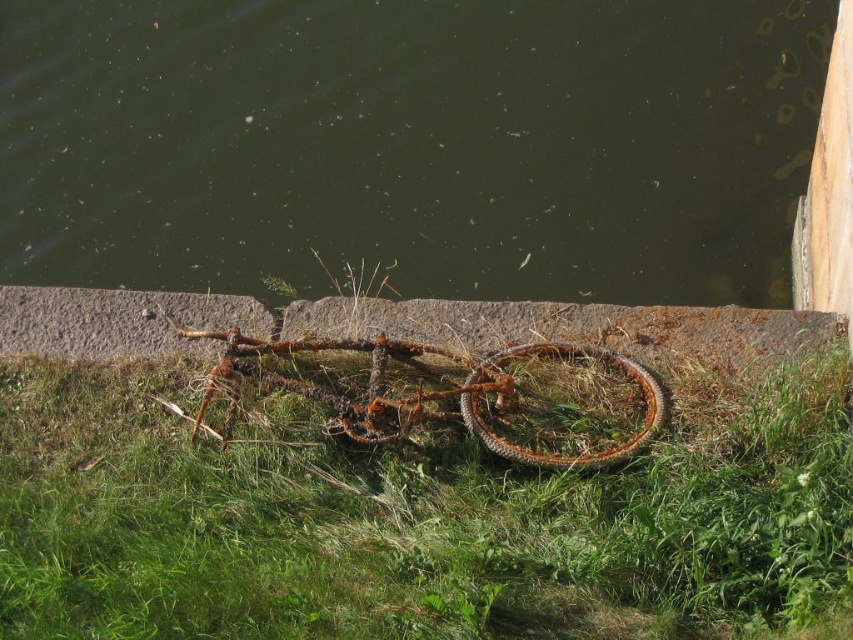
Question: Which of the following is the closest to the observer?

Choices:
 (A) rusty metal bicycle at center
 (B) green murky water at center

Answer: (A)

Question: Which point is farther to the camera?

Choices:
 (A) (155, 38)
 (B) (474, 634)

Answer: (A)

Question: Is green murky water at center further to the viewer compared to green grass at center?

Choices:
 (A) yes
 (B) no

Answer: (A)

Question: From the image, what is the correct spatial relationship of green murky water at center in relation to green grass at center?

Choices:
 (A) left
 (B) right

Answer: (A)

Question: From the image, what is the correct spatial relationship of green murky water at center in relation to green grass at center?

Choices:
 (A) right
 (B) left

Answer: (B)

Question: Considering the real-world distances, which object is closest to the green grass at center?

Choices:
 (A) rusty metal bicycle at center
 (B) green murky water at center

Answer: (A)